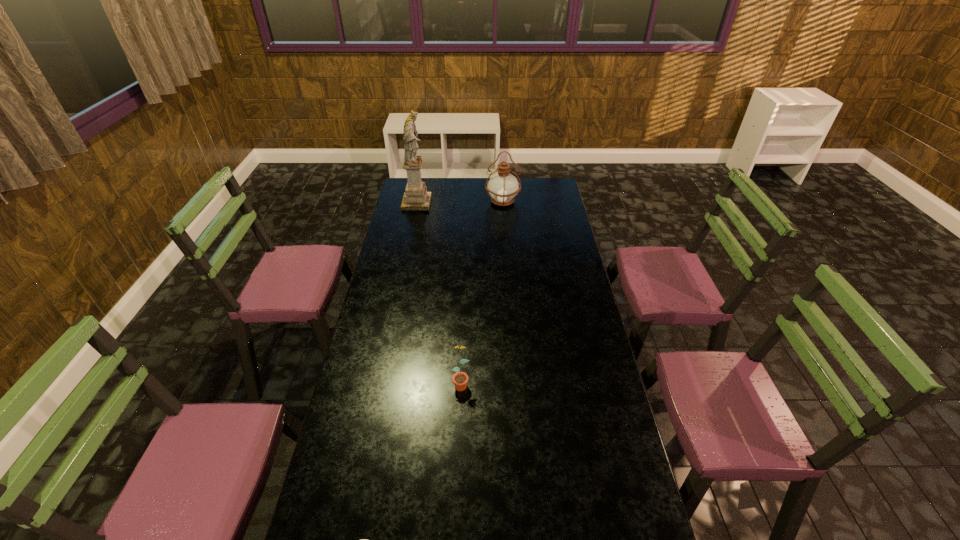
Locate an element on the screen. The height and width of the screenshot is (540, 960). object at the left edge is located at coordinates (416, 197).

At what (x,y) coordinates should I click in order to perform the action: click on object present at the far left corner. Please return your answer as a coordinate pair (x, y). Looking at the image, I should click on (416, 197).

Find the location of a particular element. The width and height of the screenshot is (960, 540). free region at the left edge of the desktop is located at coordinates (361, 386).

Where is `vacant space at the right edge of the desktop`? This screenshot has height=540, width=960. vacant space at the right edge of the desktop is located at coordinates tap(549, 297).

Where is `free space between the sculpture and the oil lamp`? free space between the sculpture and the oil lamp is located at coordinates (460, 202).

Identify the location of vacant point located between the rightmost object and the sculpture. This screenshot has height=540, width=960. (460, 202).

Locate an element on the screen. The height and width of the screenshot is (540, 960). free spot between the tallest object and the rightmost object is located at coordinates (460, 202).

Where is `vacant space in between the second nearest object and the sculpture`? The image size is (960, 540). vacant space in between the second nearest object and the sculpture is located at coordinates (439, 293).

What are the coordinates of `free space between the sculpture and the third object from left to right` in the screenshot? It's located at (439, 293).

Find the location of a particular element. This screenshot has height=540, width=960. empty space that is in between the second object from right to left and the rightmost object is located at coordinates [482, 292].